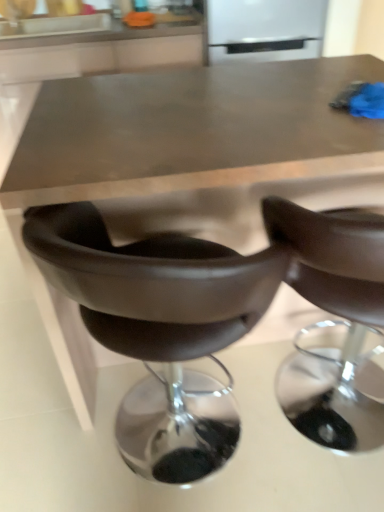
Question: From a real-world perspective, is leather-like brown chair at lower center, which ranks as the 1th chair in back-to-front order, above or below white glossy refrigerator at upper center?

Choices:
 (A) below
 (B) above

Answer: (A)

Question: Considering the positions of leather-like brown chair at lower center, which ranks as the 1th chair in back-to-front order, and white glossy refrigerator at upper center in the image, is leather-like brown chair at lower center, which ranks as the 1th chair in back-to-front order, bigger or smaller than white glossy refrigerator at upper center?

Choices:
 (A) big
 (B) small

Answer: (A)

Question: Which of these objects is positioned farthest from the brown leather chair at center, positioned as the first chair in front-to-back order?

Choices:
 (A) leather-like brown chair at lower center, which is the 2th chair in front-to-back order
 (B) white glossy refrigerator at upper center
 (C) metallic brown table at center

Answer: (B)

Question: Based on their relative distances, which object is nearer to the metallic brown table at center?

Choices:
 (A) white glossy refrigerator at upper center
 (B) brown leather chair at center, the second chair when ordered from back to front
 (C) leather-like brown chair at lower center, which ranks as the 1th chair in back-to-front order

Answer: (C)